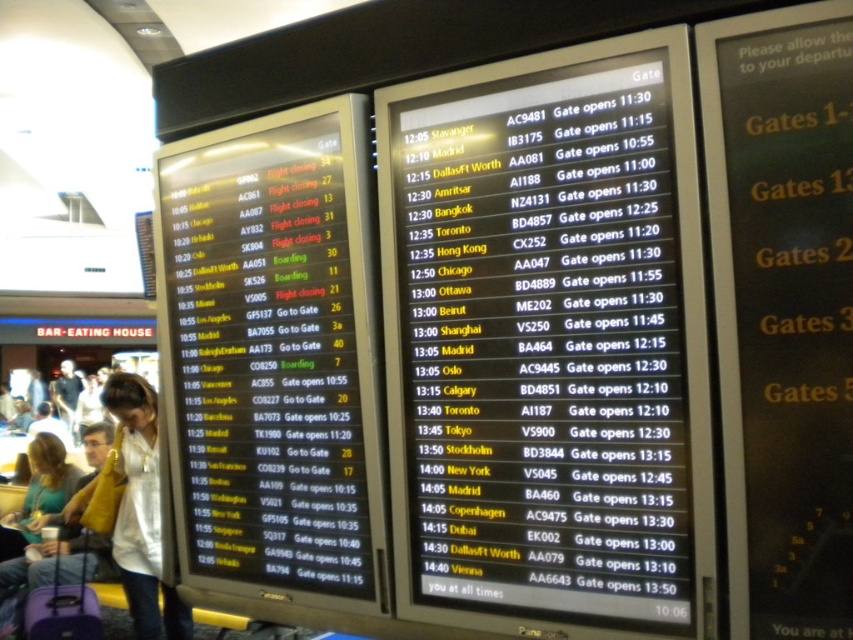
Question: Which object is the farthest from the white fabric shirt at center?

Choices:
 (A) black glossy screen at left
 (B) light beige shirt at lower left
 (C) matte purple suitcase at lower left

Answer: (A)

Question: Is black glossy screen at left bigger than white fabric shirt at center?

Choices:
 (A) yes
 (B) no

Answer: (A)

Question: Which of the following is the farthest from the observer?

Choices:
 (A) black plastic flight information board at center
 (B) light beige shirt at lower left
 (C) black glossy signboard at upper center

Answer: (B)

Question: Is black plastic flight information board at center wider than matte purple suitcase at lower left?

Choices:
 (A) no
 (B) yes

Answer: (B)

Question: Among these objects, which one is farthest from the camera?

Choices:
 (A) black glossy screen at left
 (B) black glossy signboard at upper center
 (C) black plastic flight information board at center
 (D) white fabric shirt at center

Answer: (D)

Question: Is black glossy screen at left closer to the viewer compared to white fabric shirt at center?

Choices:
 (A) yes
 (B) no

Answer: (A)